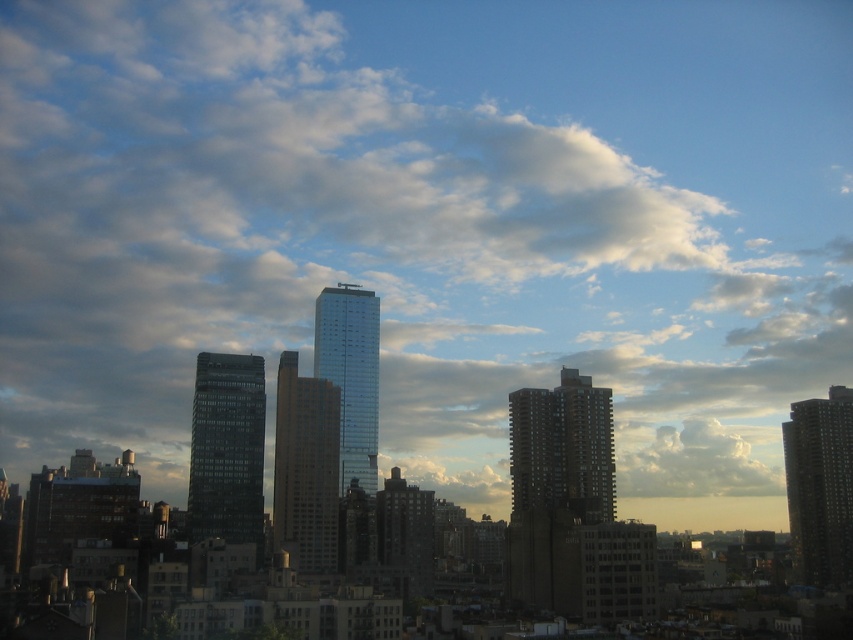
You are a drone operator tasked with flying a drone between two buildings in the city. The drone has a maximum flight distance of 50 meters. You see the dark gray concrete building at center and the glassy reflective skyscraper at center. Can your drone safely fly between them without exceeding its maximum flight distance?

The dark gray concrete building at center and the glassy reflective skyscraper at center are 56.87 meters apart from each other. Since the drone has a maximum flight distance of 50 meters, it cannot safely fly between them without exceeding its limit.

You are a city planner analyzing the urban layout. You need to determine which structure occupies more horizontal space in the image. Based on the scene, which object is wider between the dark gray concrete building at right and the glassy reflective skyscraper at center?

The dark gray concrete building at right is wider than the glassy reflective skyscraper at center according to the description.